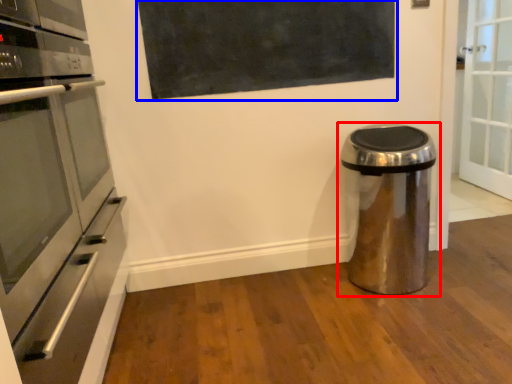
Question: Which of the following is the farthest to the observer, waste container (highlighted by a red box) or bulletin board (highlighted by a blue box)?

Choices:
 (A) waste container
 (B) bulletin board

Answer: (B)